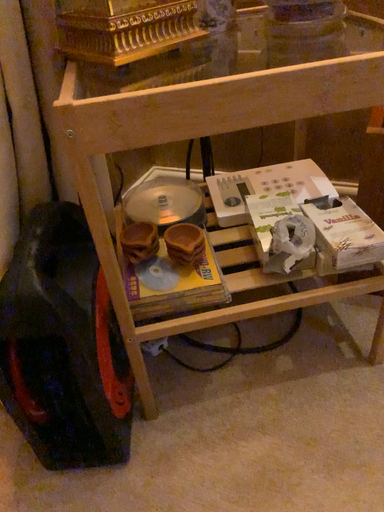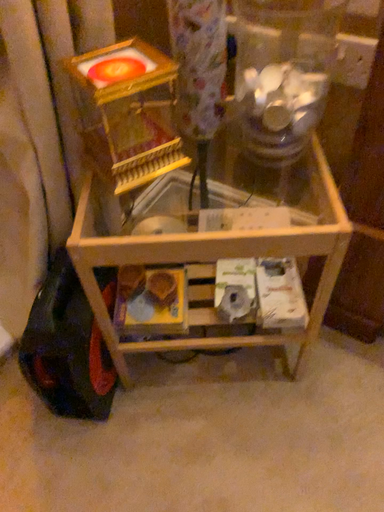
Question: Which way did the camera rotate in the video?

Choices:
 (A) rotated downward
 (B) rotated upward

Answer: (A)